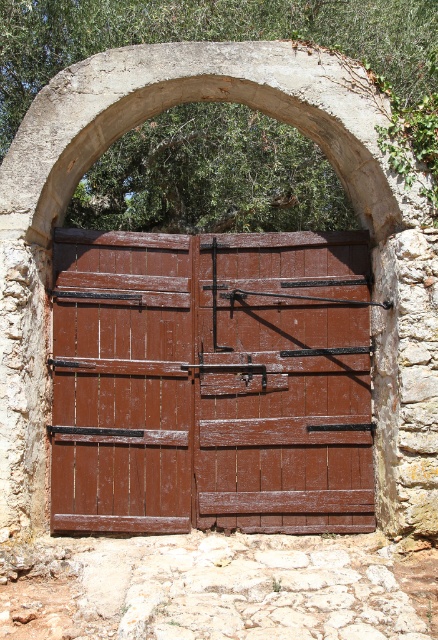
Does brown wooden gate at center have a smaller size compared to wooden gate at center?

Actually, brown wooden gate at center might be larger than wooden gate at center.

Is point (195, 332) closer to camera compared to point (168, 435)?

No, (195, 332) is further to viewer.

The height and width of the screenshot is (640, 438). I want to click on brown wooden gate at center, so click(x=211, y=381).